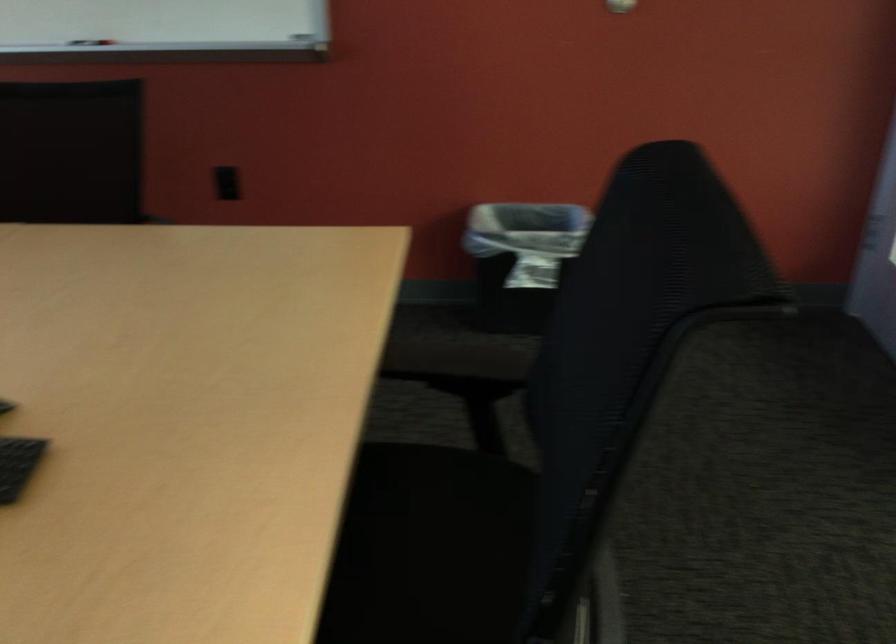
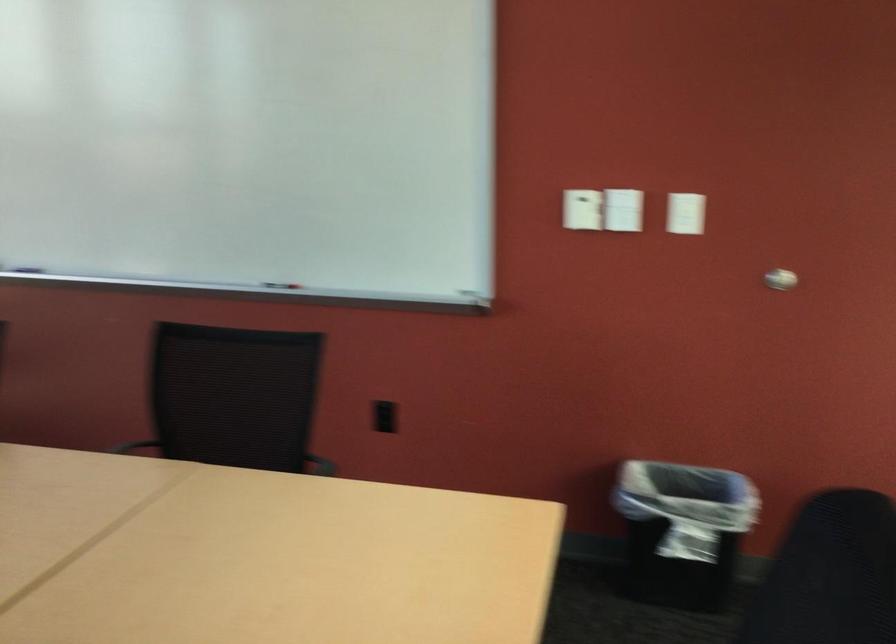
Question: The images are taken continuously from a first-person perspective. In which direction is your viewpoint rotating?

Choices:
 (A) Left
 (B) Right
 (C) Up
 (D) Down

Answer: (C)